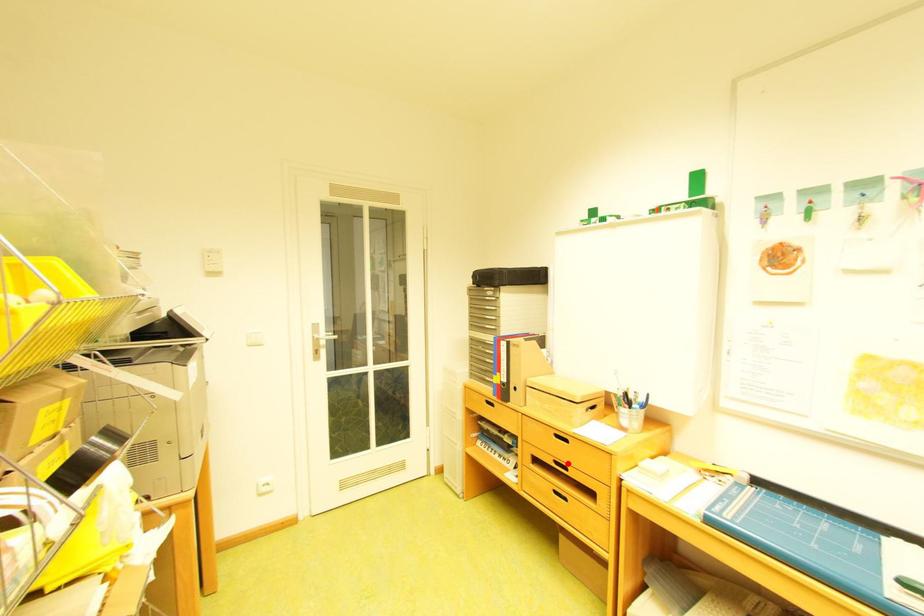
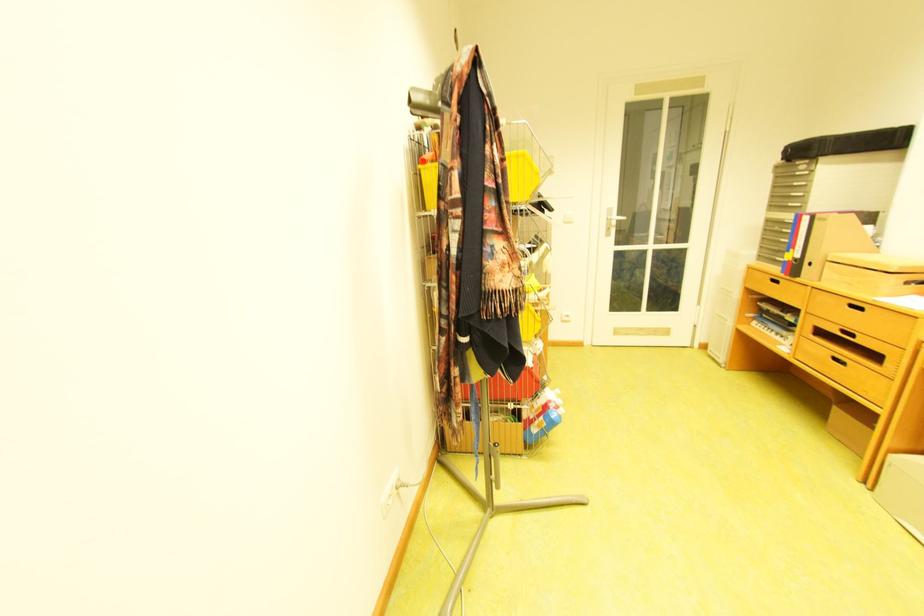
The point at the highlighted location is marked in the first image. Where is the corresponding point in the second image?

(855, 333)